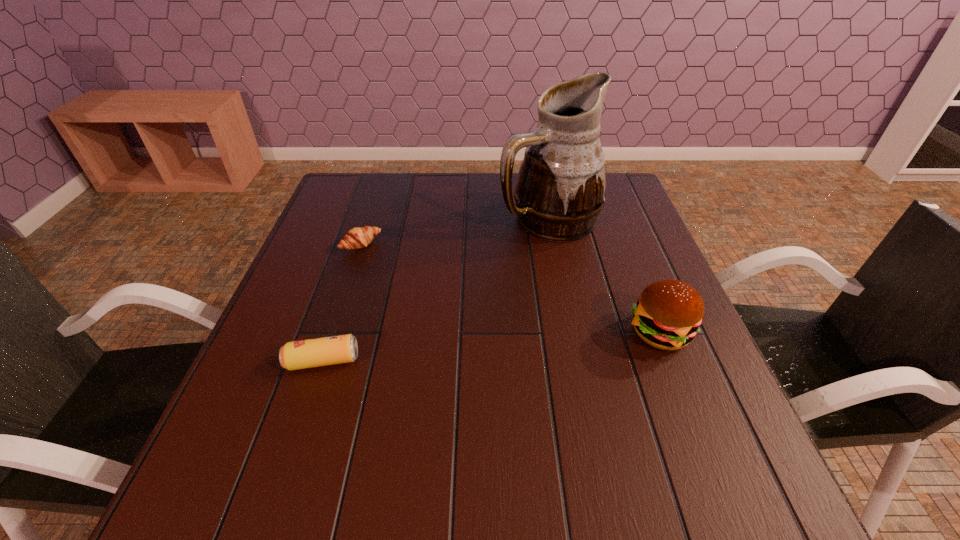
Locate an element on the screen. free area in between the shortest object and the tallest object is located at coordinates (454, 232).

Identify the location of vacant region between the pitcher and the shortest object. This screenshot has width=960, height=540. (454, 232).

Find the location of a particular element. This screenshot has height=540, width=960. free space between the pastry and the second tallest object is located at coordinates (511, 288).

I want to click on free space between the pastry and the beer can, so click(342, 302).

Identify the location of object that stands as the second closest to the tallest object. The width and height of the screenshot is (960, 540). (356, 238).

The height and width of the screenshot is (540, 960). I want to click on the second closest object relative to the shortest object, so click(x=560, y=191).